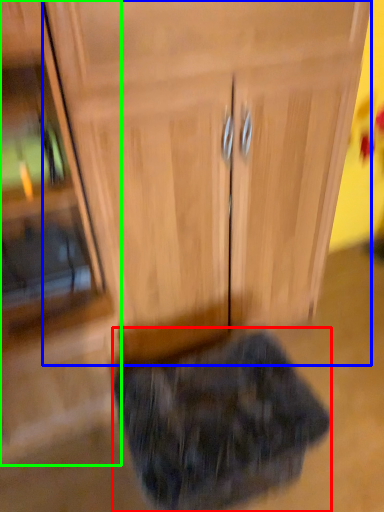
Question: Based on their relative distances, which object is nearer to animal (highlighted by a red box)? Choose from cabinetry (highlighted by a blue box) and side cabinet (highlighted by a green box).

Choices:
 (A) cabinetry
 (B) side cabinet

Answer: (B)